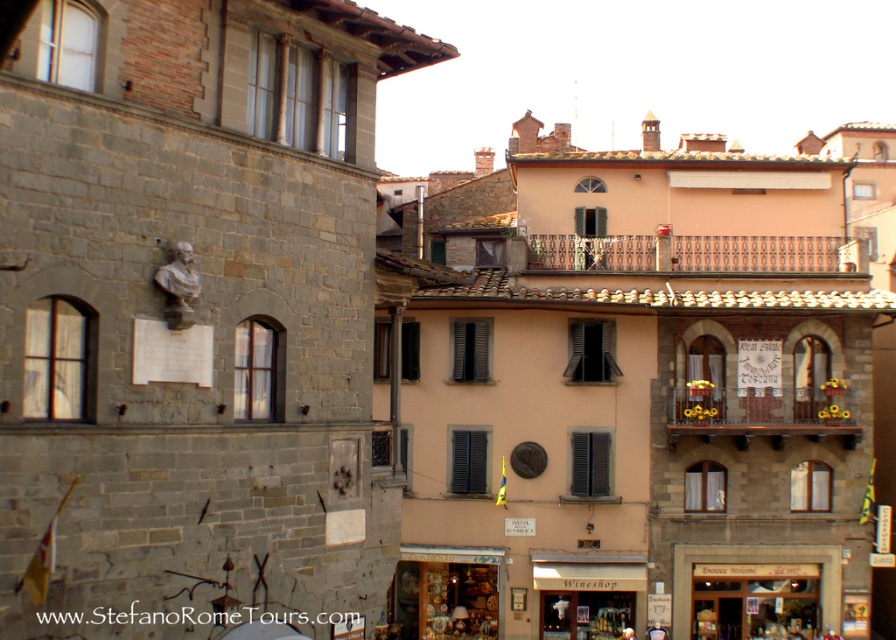
You are a tourist visiting this historic town and want to enter the shop. You see the matte ceramic shop at center and the wooden door at lower right. Which one is larger in size?

The matte ceramic shop at center is bigger than the wooden door at lower right.

Consider the image. You are a tourist standing on the street looking at the matte ceramic shop at center and the wooden door at lower right. Which object is closer to you?

The matte ceramic shop at center is closer to you because it is further to the viewer than the wooden door at lower right.

You are a tourist walking down the street and want to visit both the matte ceramic shop at center and the matte brown wooden wine shop at center. Which shop should you approach first to reach the one closer to you?

You should approach the matte ceramic shop at center first because it is closer to you than the matte brown wooden wine shop at center.